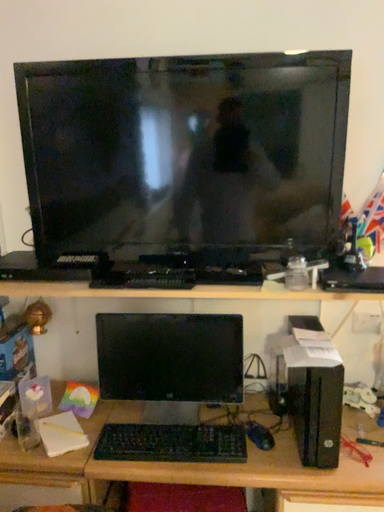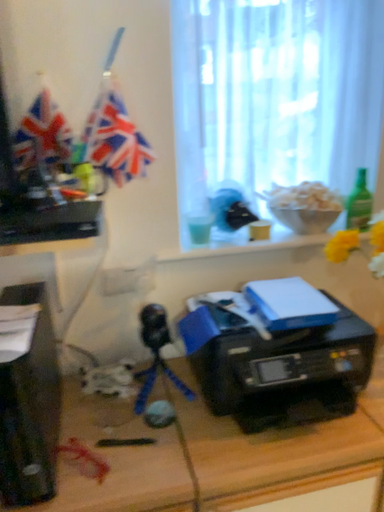
Question: Which way did the camera rotate in the video?

Choices:
 (A) rotated left
 (B) rotated right

Answer: (B)